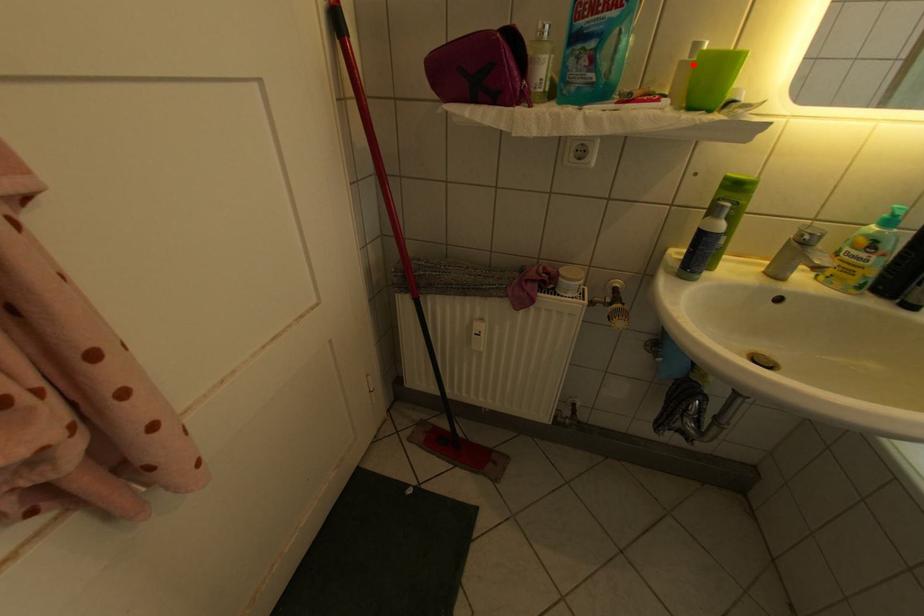
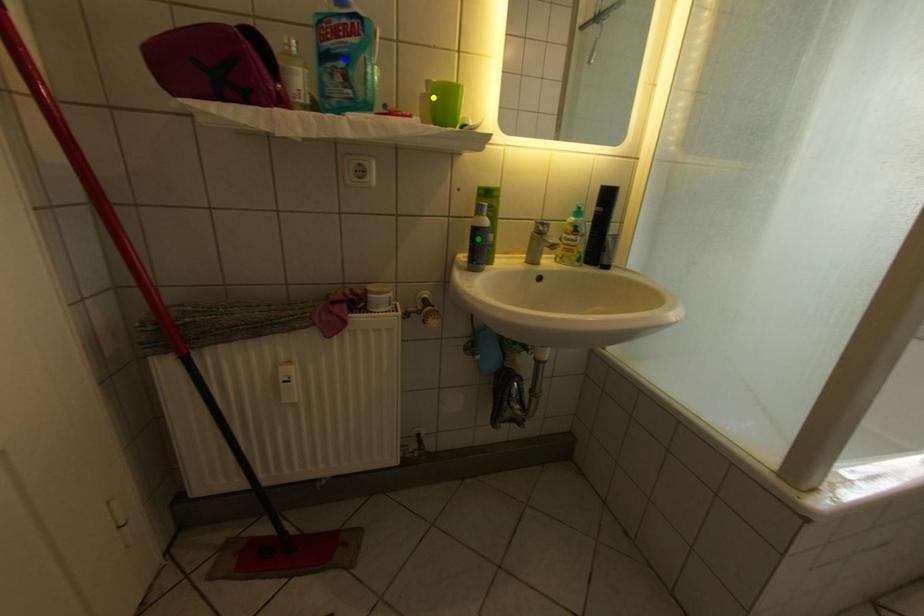
Question: I am providing you with two images of the same scene from different viewpoints. A red point is marked on the first image. You are given multiple points on the second image. In image 2, which mark is for the same physical point as the one in image 1?

Choices:
 (A) yellow point
 (B) blue point
 (C) green point

Answer: (A)